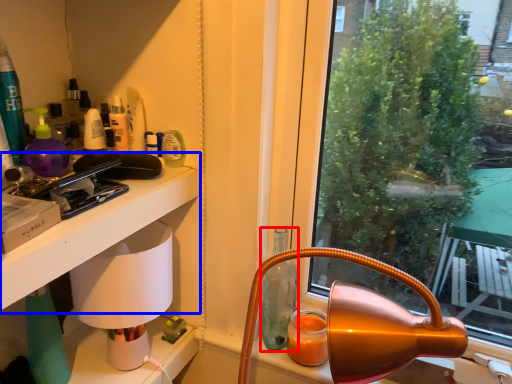
Question: Which object appears closest to the camera in this image, bottle (highlighted by a red box) or table (highlighted by a blue box)?

Choices:
 (A) bottle
 (B) table

Answer: (B)